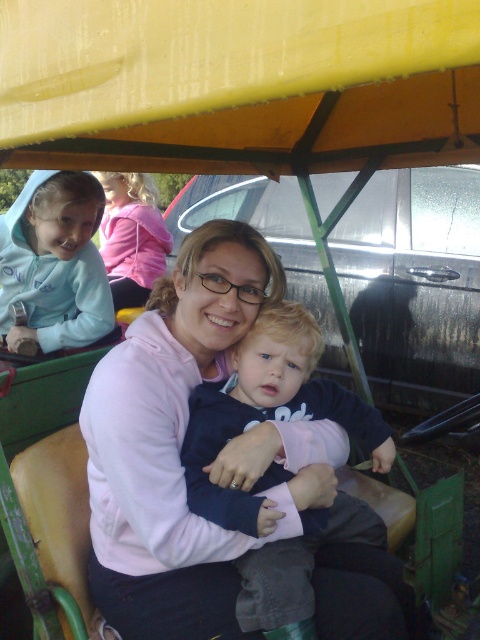
Question: Considering the real-world distances, which object is closest to the dark blue fleece at center?

Choices:
 (A) pink fleece jacket at upper left
 (B) light blue fleece jacket at upper left

Answer: (B)

Question: Considering the relative positions of light blue fleece jacket at upper left and pink fleece jacket at upper left in the image provided, where is light blue fleece jacket at upper left located with respect to pink fleece jacket at upper left?

Choices:
 (A) right
 (B) left

Answer: (A)

Question: Where is light blue fleece jacket at upper left located in relation to pink fleece jacket at upper left in the image?

Choices:
 (A) right
 (B) left

Answer: (A)

Question: Which point appears farthest from the camera in this image?

Choices:
 (A) (70, 275)
 (B) (108, 179)

Answer: (B)

Question: Is light blue fleece jacket at upper left further to camera compared to pink fleece jacket at upper left?

Choices:
 (A) yes
 (B) no

Answer: (B)

Question: Which object is the farthest from the dark blue fleece at center?

Choices:
 (A) light blue fleece jacket at upper left
 (B) pink fleece jacket at upper left

Answer: (B)